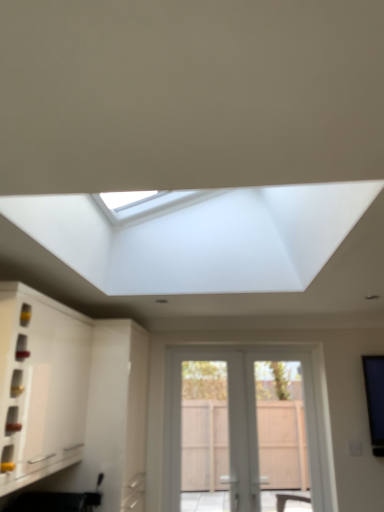
Question: In terms of size, does white wooden door at center appear bigger or smaller than white matte cabinet at left?

Choices:
 (A) small
 (B) big

Answer: (A)

Question: From the image's perspective, is white wooden door at center located above or below white matte cabinet at left?

Choices:
 (A) below
 (B) above

Answer: (A)

Question: Would you say white wooden door at center is inside or outside white matte cabinet at left?

Choices:
 (A) inside
 (B) outside

Answer: (B)

Question: In the image, is white matte cabinet at left on the left side or the right side of white wooden door at center?

Choices:
 (A) right
 (B) left

Answer: (B)

Question: Considering the positions of white matte cabinet at left and white wooden door at center in the image, is white matte cabinet at left wider or thinner than white wooden door at center?

Choices:
 (A) thin
 (B) wide

Answer: (B)

Question: Does point (56, 311) appear closer or farther from the camera than point (175, 455)?

Choices:
 (A) closer
 (B) farther

Answer: (A)

Question: From a real-world perspective, is white matte cabinet at left positioned above or below white wooden door at center?

Choices:
 (A) above
 (B) below

Answer: (A)